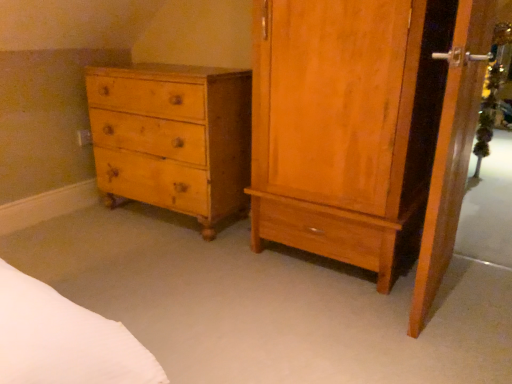
Question: Considering the positions of point (455, 150) and point (414, 26), is point (455, 150) closer or farther from the camera than point (414, 26)?

Choices:
 (A) closer
 (B) farther

Answer: (B)

Question: Considering their positions, is wooden screen door at right located in front of or behind light brown wood cabinet at right?

Choices:
 (A) front
 (B) behind

Answer: (A)

Question: Estimate the real-world distances between objects in this image. Which object is farther from the wooden screen door at right?

Choices:
 (A) yellow wood chest of drawers at left
 (B) light brown wood cabinet at right

Answer: (A)

Question: Which of these objects is positioned farthest from the yellow wood chest of drawers at left?

Choices:
 (A) light brown wood cabinet at right
 (B) wooden screen door at right

Answer: (B)